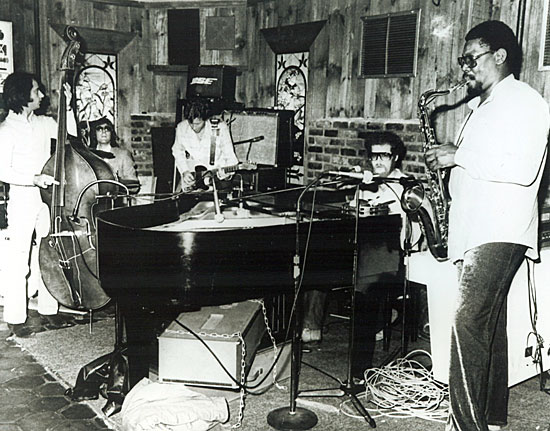
The width and height of the screenshot is (550, 431). I want to click on rug, so click(311, 379), click(60, 347), click(526, 410).